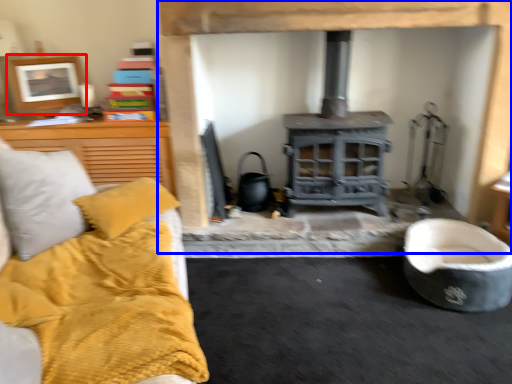
Question: Among these objects, which one is farthest to the camera, picture frame (highlighted by a red box) or fireplace (highlighted by a blue box)?

Choices:
 (A) picture frame
 (B) fireplace

Answer: (A)